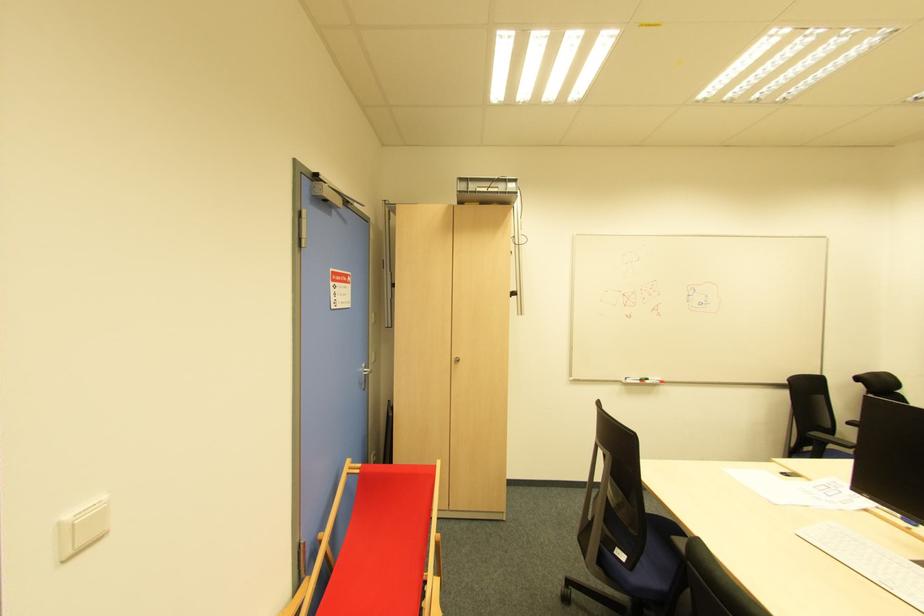
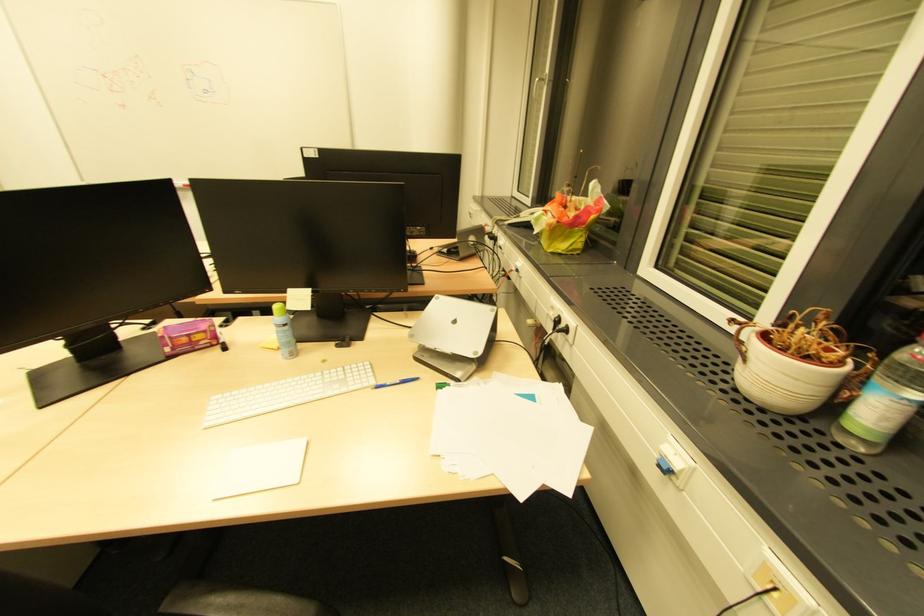
Question: I am providing you with two images of the same scene from different viewpoints. Please identify which objects are invisible in image2.

Choices:
 (A) whiteboard marker
 (B) white window handle
 (C) bottle pump top
 (D) blue pen

Answer: (A)